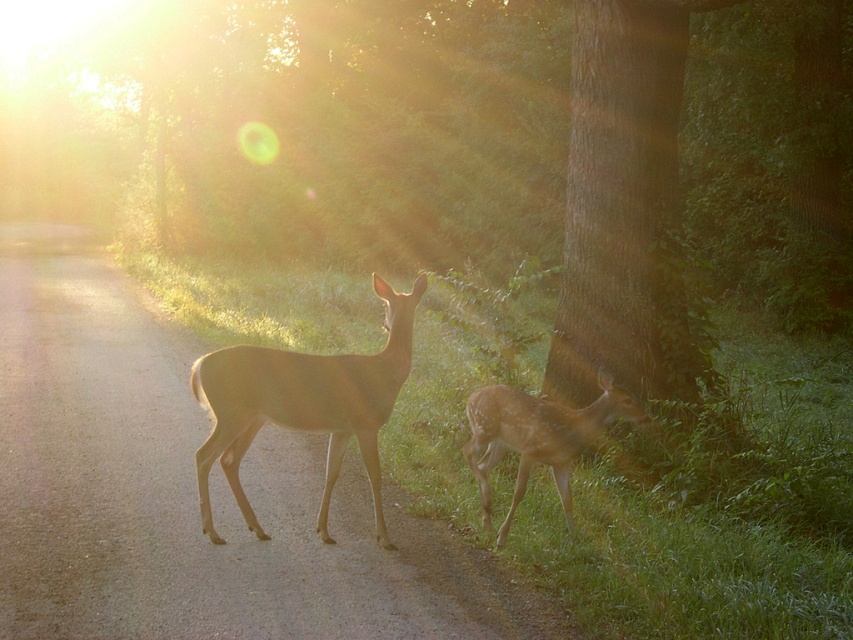
Is brown gravel path at center closer to camera compared to spotted fur fawn at lower right?

Yes.

Image resolution: width=853 pixels, height=640 pixels. What do you see at coordinates (189, 490) in the screenshot?
I see `brown gravel path at center` at bounding box center [189, 490].

Where is `brown gravel path at center`? brown gravel path at center is located at coordinates (189, 490).

Does brown gravel path at center have a larger size compared to golden fur deer at center?

Yes.

Does brown gravel path at center appear over golden fur deer at center?

No.

Is point (28, 417) behind point (282, 368)?

That is True.

The width and height of the screenshot is (853, 640). What are the coordinates of `brown gravel path at center` in the screenshot? It's located at coord(189,490).

Is golden fur deer at center shorter than spotted fur fawn at lower right?

No.

Is point (225, 356) closer to camera compared to point (555, 484)?

Yes, it is in front of point (555, 484).

Is point (335, 410) less distant than point (573, 413)?

That is False.

This screenshot has height=640, width=853. Find the location of `golden fur deer at center`. golden fur deer at center is located at coordinates (303, 404).